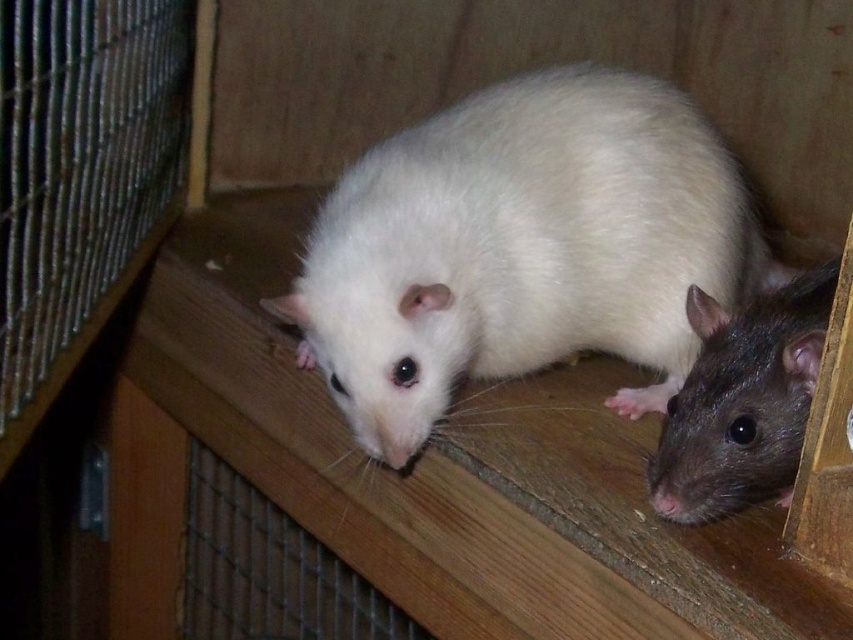
You are a pet owner who wants to place a new toy in the enclosure for both the white fluffy hamster at center and the shiny gray fur at center. To ensure both can reach it easily, where should you place the toy?

The toy should be placed near the white fluffy hamster at center since it is positioned over the shiny gray fur at center, making it accessible to both.

You are a veterinarian observing two rodents in an enclosure. You notice a white fluffy hamster at center and a shiny gray fur at center. Which rodent is positioned to the left?

The white fluffy hamster at center is positioned to the left of the shiny gray fur at center.

What are the coordinates of the white fluffy hamster at center?

The white fluffy hamster at center is located at coordinates point (521,248).